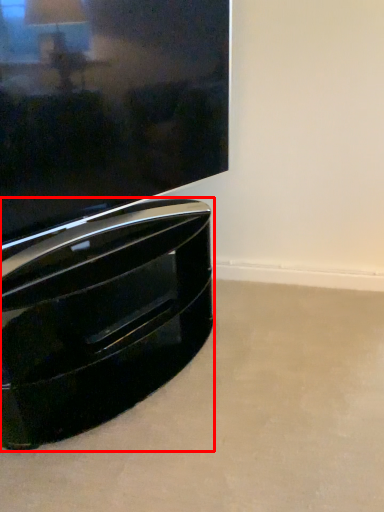
Question: Observing the image, what is the correct spatial positioning of furniture (annotated by the red box) in reference to television?

Choices:
 (A) left
 (B) right

Answer: (A)